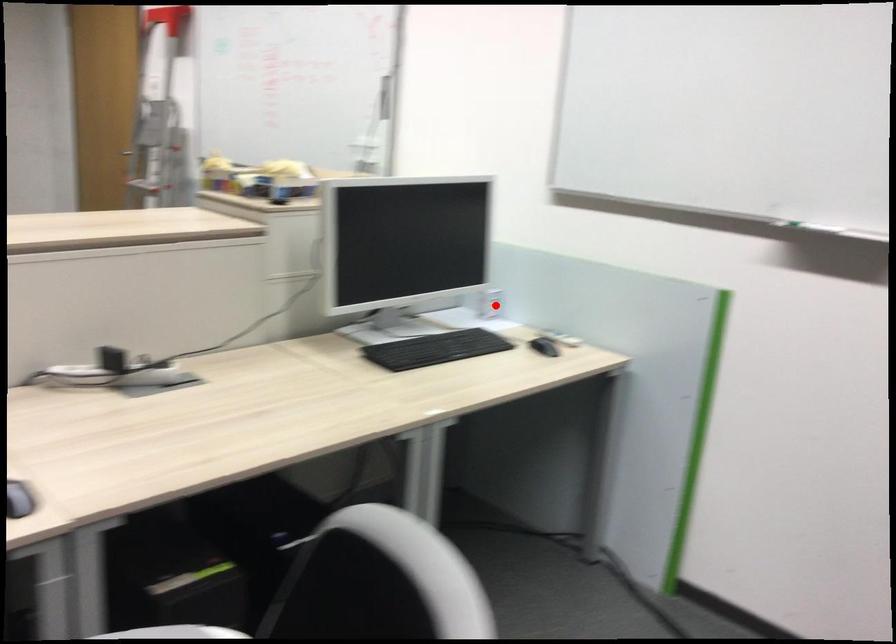
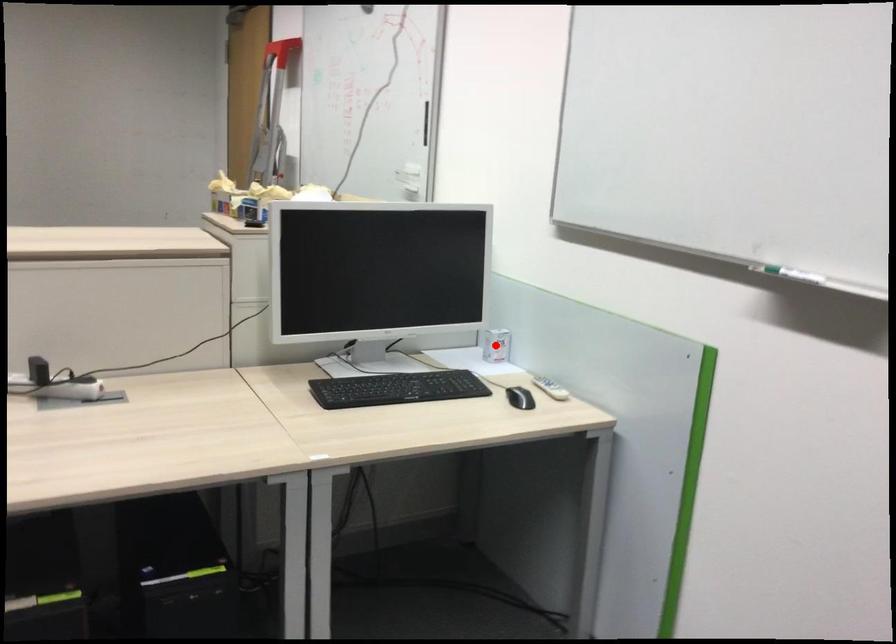
I am providing you with two images of the same scene from different viewpoints. A red point is marked on the first image and another point is marked on the second image. Are the points marked in image1 and image2 representing the same 3D position?

Yes